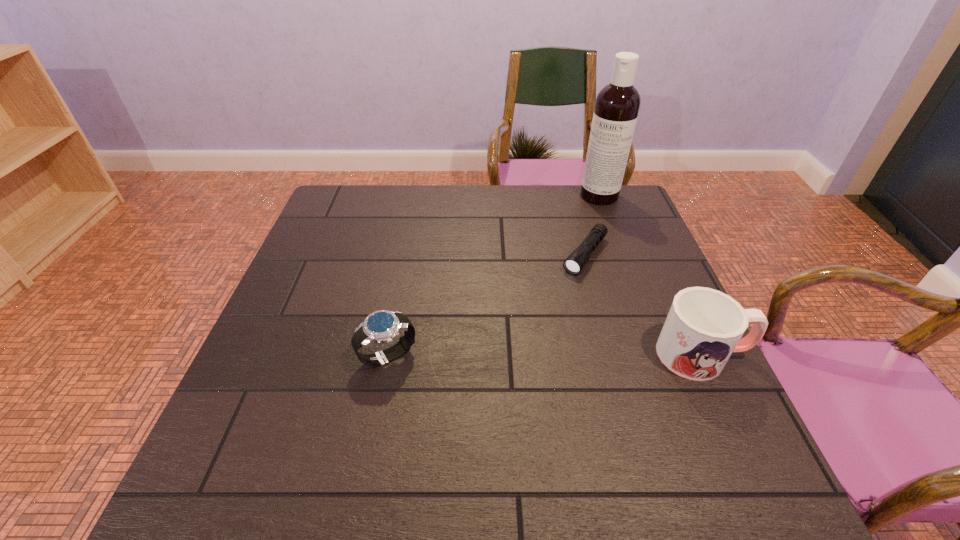
The image size is (960, 540). What are the coordinates of `vacant spot on the desktop that is between the leftmost object and the mug and is positioned at the lens end of the flashlight` in the screenshot? It's located at (508, 355).

Find the location of a particular element. The image size is (960, 540). vacant space on the desktop that is between the watch and the mug and is positioned on the label side of the farthest object is located at coordinates (540, 355).